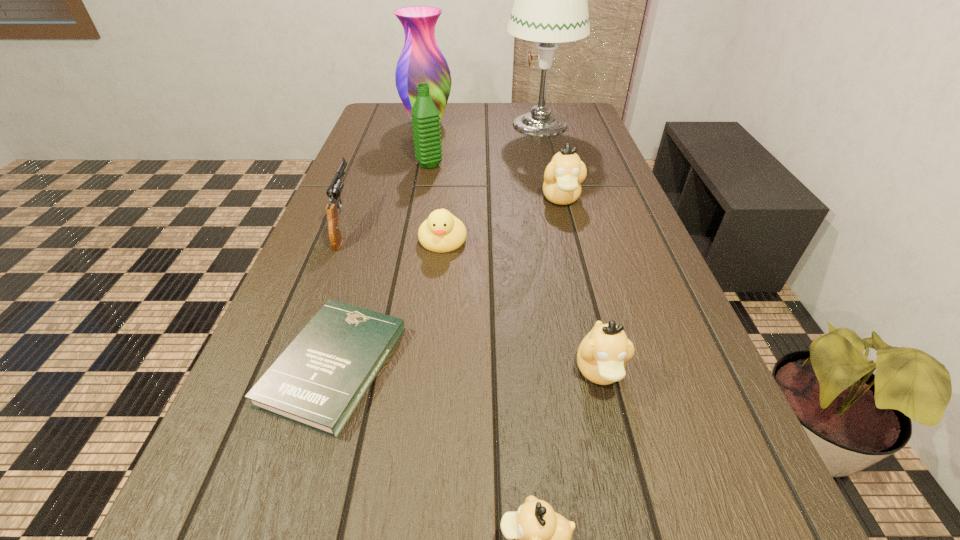
At what (x,y) coordinates should I click in order to perform the action: click on free space located along the barrel of the gun. Please return your answer as a coordinate pair (x, y). Looking at the image, I should click on pyautogui.click(x=378, y=139).

Locate an element on the screen. The image size is (960, 540). free spot located 0.240m along the barrel of the gun is located at coordinates (371, 158).

Locate an element on the screen. This screenshot has width=960, height=540. vacant region located 0.210m along the barrel of the gun is located at coordinates (369, 163).

Image resolution: width=960 pixels, height=540 pixels. I want to click on free space located on the face of the third shortest duckling, so click(630, 493).

Image resolution: width=960 pixels, height=540 pixels. Identify the location of free space located 0.180m on the face of the leftmost duckling. (435, 317).

This screenshot has height=540, width=960. Find the location of `free space located on the back of the book`. free space located on the back of the book is located at coordinates (382, 205).

Locate an element on the screen. The height and width of the screenshot is (540, 960). lampshade at the far edge is located at coordinates (550, 6).

Find the location of a particular element. This screenshot has width=960, height=540. vase at the far edge is located at coordinates (421, 61).

Find the location of `vase that is at the left edge`. vase that is at the left edge is located at coordinates (421, 61).

The image size is (960, 540). Identify the location of gun situated at the left edge. (334, 191).